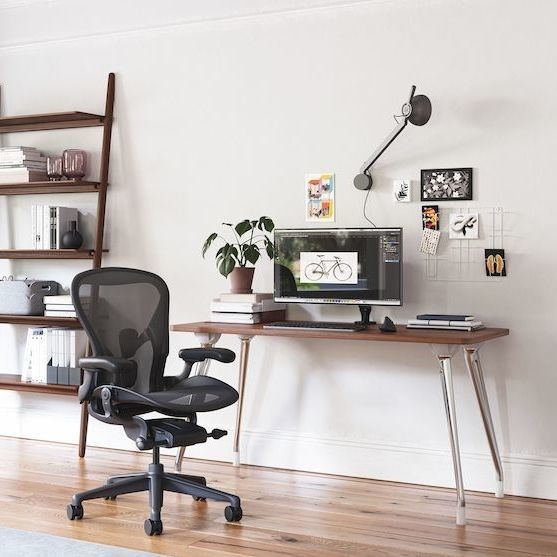
The height and width of the screenshot is (557, 557). I want to click on desk, so click(x=405, y=334).